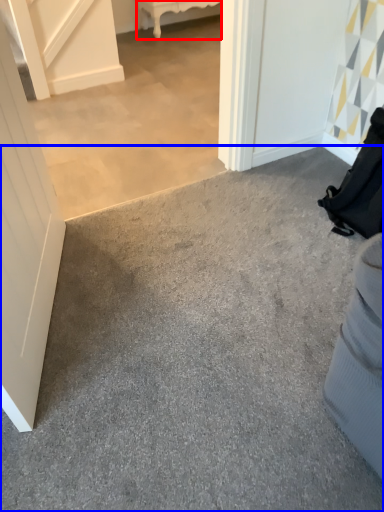
Question: Which point is closer to the camera, furniture (highlighted by a red box) or concrete (highlighted by a blue box)?

Choices:
 (A) furniture
 (B) concrete

Answer: (B)